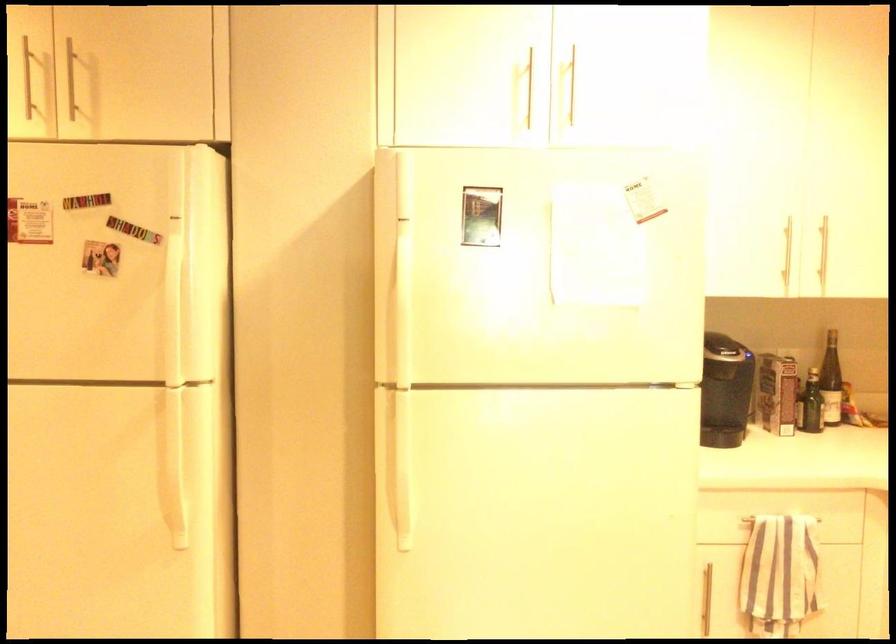
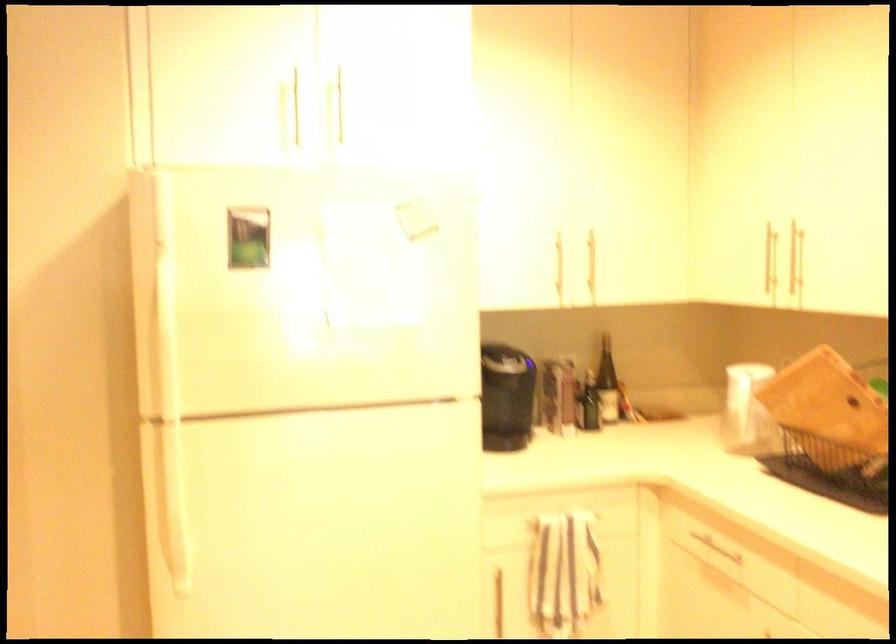
Question: The first image is from the beginning of the video and the second image is from the end. How did the camera likely rotate when shooting the video?

Choices:
 (A) Left
 (B) Right
 (C) Up
 (D) Down

Answer: (B)